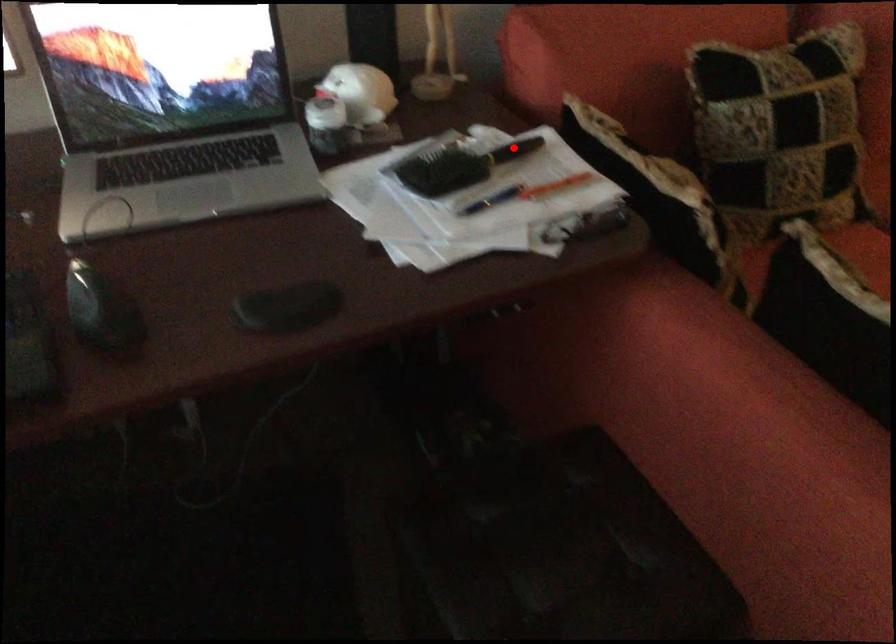
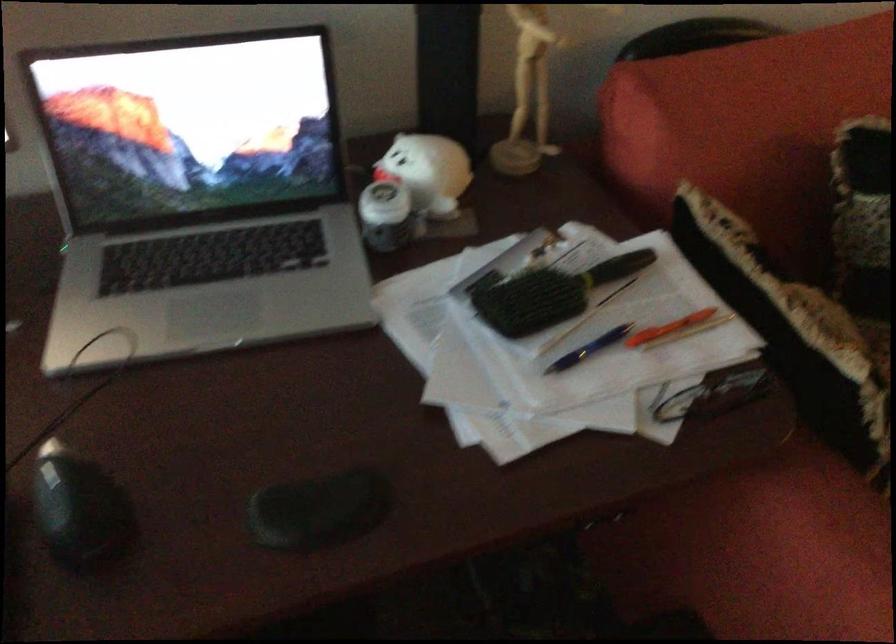
Question: I am providing you with two images of the same scene from different viewpoints. In image1, a red point is highlighted. Considering the same 3D point in image2, which of the following is correct?

Choices:
 (A) It is closer
 (B) It is farther

Answer: (A)